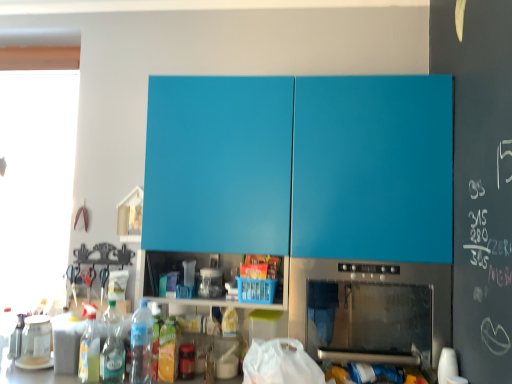
Find the location of `clear plastic bottle at lower left, marked as the 2th bottle in a right-to-left arrangement`. clear plastic bottle at lower left, marked as the 2th bottle in a right-to-left arrangement is located at coordinates (112, 348).

Describe the element at coordinates (35, 342) in the screenshot. I see `transparent glass jar at lower left, the second appliance when ordered from right to left` at that location.

This screenshot has width=512, height=384. I want to click on translucent plastic bottle at lower left, positioned as the third bottle in left-to-right order, so tap(141, 345).

I want to click on transparent glass window at left, so click(36, 183).

Considering the sizes of objects transparent plastic jar at center, which ranks as the 1th appliance in right-to-left order, and transparent glass jar at lower left, the 2th appliance positioned from the front, in the image provided, who is thinner, transparent plastic jar at center, which ranks as the 1th appliance in right-to-left order, or transparent glass jar at lower left, the 2th appliance positioned from the front,?

With smaller width is transparent plastic jar at center, which ranks as the 1th appliance in right-to-left order.

Can you confirm if transparent plastic jar at center, which ranks as the 1th appliance in right-to-left order, is smaller than transparent glass jar at lower left, the 2th appliance viewed from the top?

Yes.

From a real-world perspective, who is located higher, transparent plastic jar at center, which ranks as the 1th appliance in right-to-left order, or transparent glass jar at lower left, which is counted as the 1th appliance, starting from the left?

transparent plastic jar at center, which ranks as the 1th appliance in right-to-left order, from a real-world perspective.

Is transparent plastic jar at center, the 2th appliance in the back-to-front sequence, in front of or behind transparent glass jar at lower left, which is counted as the 1th appliance, starting from the left, in the image?

transparent plastic jar at center, the 2th appliance in the back-to-front sequence, is positioned closer to the viewer than transparent glass jar at lower left, which is counted as the 1th appliance, starting from the left.

From the image's perspective, between translucent plastic bottle at lower left, the third bottle viewed from the right, and stainless steel oven at lower center, which one is located above?

stainless steel oven at lower center.

From a real-world perspective, relative to stainless steel oven at lower center, is translucent plastic bottle at lower left, the third bottle viewed from the right, vertically above or below?

From a real-world perspective, translucent plastic bottle at lower left, the third bottle viewed from the right, is physically below stainless steel oven at lower center.

Which of these two, translucent plastic bottle at lower left, the third bottle viewed from the right, or stainless steel oven at lower center, stands taller?

Standing taller between the two is stainless steel oven at lower center.

Is translucent plastic bottle at lower left, the third bottle viewed from the right, far away from stainless steel oven at lower center?

That's not correct — translucent plastic bottle at lower left, the third bottle viewed from the right, is a little close to stainless steel oven at lower center.

Does transparent glass window at left lie behind transparent glass jar at lower left, the 1th appliance from the bottom?

That is True.

Consider the image. Visually, is transparent glass window at left positioned to the left or to the right of transparent glass jar at lower left, which is counted as the 1th appliance, starting from the left?

transparent glass window at left is positioned on transparent glass jar at lower left, which is counted as the 1th appliance, starting from the left,'s left side.

Based on the photo, is transparent glass window at left inside or outside of transparent glass jar at lower left, the 1th appliance from the bottom?

transparent glass window at left is located beyond the bounds of transparent glass jar at lower left, the 1th appliance from the bottom.

Is transparent glass window at left wider or thinner than transparent glass jar at lower left, the 2th appliance viewed from the top?

transparent glass window at left is wider than transparent glass jar at lower left, the 2th appliance viewed from the top.

Is transparent glass jar at lower left, the 2th appliance viewed from the top, positioned with its back to matte blue cabinet at upper center?

No.

Identify the location of cabinetry above the transparent glass jar at lower left, which is counted as the 1th appliance, starting from the left (from a real-world perspective). The width and height of the screenshot is (512, 384). (301, 166).

Measure the distance from transparent glass jar at lower left, the 1th appliance from the bottom, to matte blue cabinet at upper center.

They are 1.26 meters apart.

From a real-world perspective, is transparent glass window at left positioned above or below translucent plastic bottle at lower left, which is the 1th bottle from left to right?

From a real-world perspective, transparent glass window at left is physically above translucent plastic bottle at lower left, which is the 1th bottle from left to right.

From the image's perspective, which one is positioned lower, transparent glass window at left or translucent plastic bottle at lower left, the third bottle viewed from the right?

translucent plastic bottle at lower left, the third bottle viewed from the right, appears lower in the image.

Find the location of `window on the left side of translucent plastic bottle at lower left, the third bottle viewed from the right`. window on the left side of translucent plastic bottle at lower left, the third bottle viewed from the right is located at coordinates (36, 183).

Does transparent glass window at left turn towards translucent plastic bottle at lower left, the third bottle viewed from the right?

No, transparent glass window at left is not aimed at translucent plastic bottle at lower left, the third bottle viewed from the right.

Between transparent plastic jar at center, which is the 1th appliance from top to bottom, and transparent glass window at left, which one appears on the right side from the viewer's perspective?

transparent plastic jar at center, which is the 1th appliance from top to bottom.

From the image's perspective, between transparent plastic jar at center, which appears as the second appliance when ordered from the bottom, and transparent glass window at left, who is located below?

transparent plastic jar at center, which appears as the second appliance when ordered from the bottom, appears lower in the image.

Could you measure the distance between transparent plastic jar at center, which is the 1th appliance from top to bottom, and transparent glass window at left?

The distance of transparent plastic jar at center, which is the 1th appliance from top to bottom, from transparent glass window at left is 7.14 feet.

Between transparent plastic jar at center, the first appliance when ordered from front to back, and transparent glass window at left, which one has more height?

Standing taller between the two is transparent glass window at left.

How many degrees apart are the facing directions of matte blue cabinet at upper center and clear plastic bottle at lower left, positioned as the second bottle in left-to-right order?

There is a 0.000665-degree angle between the facing directions of matte blue cabinet at upper center and clear plastic bottle at lower left, positioned as the second bottle in left-to-right order.

Does matte blue cabinet at upper center have a greater width compared to clear plastic bottle at lower left, marked as the 2th bottle in a right-to-left arrangement?

Correct, the width of matte blue cabinet at upper center exceeds that of clear plastic bottle at lower left, marked as the 2th bottle in a right-to-left arrangement.

Which of these two, matte blue cabinet at upper center or clear plastic bottle at lower left, positioned as the second bottle in left-to-right order, stands shorter?

Standing shorter between the two is clear plastic bottle at lower left, positioned as the second bottle in left-to-right order.

Which is more to the right, matte blue cabinet at upper center or clear plastic bottle at lower left, positioned as the second bottle in left-to-right order?

matte blue cabinet at upper center is more to the right.

Locate an element on the screen. Image resolution: width=512 pixels, height=384 pixels. appliance above the transparent glass jar at lower left, arranged as the first appliance when viewed from the back (from the image's perspective) is located at coordinates (210, 283).

Where is `home appliance in front of the translucent plastic bottle at lower left, which is the 1th bottle from left to right`? The image size is (512, 384). home appliance in front of the translucent plastic bottle at lower left, which is the 1th bottle from left to right is located at coordinates (371, 310).

When comparing their distances from transparent plastic jar at center, which is the 1th appliance from top to bottom, does translucent plastic bottle at lower left, which is the 1th bottle from left to right, or translucent plastic bottle at lower left, arranged as the first bottle when viewed from the right, seem further?

translucent plastic bottle at lower left, which is the 1th bottle from left to right.

When comparing their distances from transparent plastic jar at center, the first appliance when ordered from front to back, does clear plastic bottle at lower left, marked as the 2th bottle in a right-to-left arrangement, or transparent glass jar at lower left, the 2th appliance positioned from the front, seem further?

The object further to transparent plastic jar at center, the first appliance when ordered from front to back, is transparent glass jar at lower left, the 2th appliance positioned from the front.

From the image, which object appears to be farther from transparent glass jar at lower left, arranged as the first appliance when viewed from the back, transparent plastic jar at center, the first appliance when ordered from front to back, or matte blue cabinet at upper center?

Among the two, matte blue cabinet at upper center is located further to transparent glass jar at lower left, arranged as the first appliance when viewed from the back.

Looking at the image, which one is located closer to transparent glass window at left, stainless steel oven at lower center or matte blue cabinet at upper center?

Among the two, matte blue cabinet at upper center is located nearer to transparent glass window at left.

When comparing their distances from clear plastic bottle at lower left, positioned as the second bottle in left-to-right order, does transparent plastic jar at center, the 2th appliance when ordered from left to right, or transparent glass window at left seem further?

transparent glass window at left.

When comparing their distances from stainless steel oven at lower center, does clear plastic bottle at lower left, positioned as the second bottle in left-to-right order, or matte blue cabinet at upper center seem closer?

Among the two, matte blue cabinet at upper center is located nearer to stainless steel oven at lower center.

From the image, which object appears to be nearer to transparent glass window at left, stainless steel oven at lower center or transparent glass jar at lower left, the 1th appliance from the bottom?

transparent glass jar at lower left, the 1th appliance from the bottom, is positioned closer to the anchor transparent glass window at left.

Estimate the real-world distances between objects in this image. Which object is closer to transparent glass jar at lower left, arranged as the first appliance when viewed from the back, stainless steel oven at lower center or transparent plastic jar at center, which is the 1th appliance from top to bottom?

transparent plastic jar at center, which is the 1th appliance from top to bottom, is closer to transparent glass jar at lower left, arranged as the first appliance when viewed from the back.

At what (x,y) coordinates should I click in order to perform the action: click on cabinetry located between translucent plastic bottle at lower left, arranged as the first bottle when viewed from the right, and stainless steel oven at lower center in the left-right direction. Please return your answer as a coordinate pair (x, y). This screenshot has height=384, width=512. Looking at the image, I should click on (301, 166).

Locate an element on the screen. appliance between transparent glass jar at lower left, the 2th appliance viewed from the top, and stainless steel oven at lower center from left to right is located at coordinates (210, 283).

The width and height of the screenshot is (512, 384). In order to click on appliance between translucent plastic bottle at lower left, positioned as the third bottle in left-to-right order, and matte blue cabinet at upper center, in the horizontal direction in this screenshot , I will do `click(210, 283)`.

The image size is (512, 384). In order to click on cabinetry between clear plastic bottle at lower left, marked as the 2th bottle in a right-to-left arrangement, and stainless steel oven at lower center from left to right in this screenshot , I will do `click(301, 166)`.